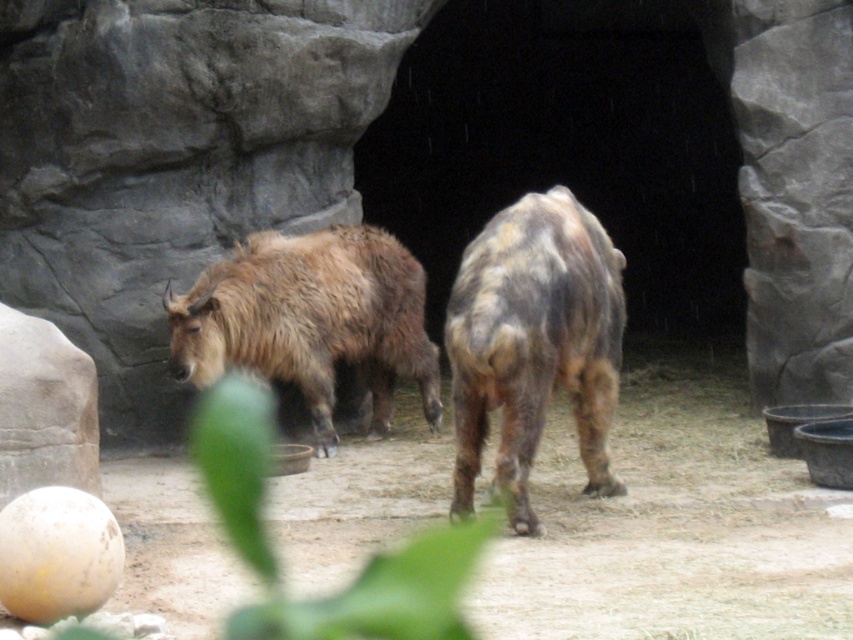
Question: From the image, what is the correct spatial relationship of brown fuzzy yak at center in relation to fuzzy brown yak at center?

Choices:
 (A) left
 (B) right

Answer: (B)

Question: Which object appears farthest from the camera in this image?

Choices:
 (A) brown fuzzy yak at center
 (B) fuzzy brown yak at center

Answer: (B)

Question: Which of the following is the farthest from the observer?

Choices:
 (A) brown fuzzy yak at center
 (B) fuzzy brown yak at center

Answer: (B)

Question: Is the position of brown fuzzy yak at center more distant than that of fuzzy brown yak at center?

Choices:
 (A) no
 (B) yes

Answer: (A)

Question: Which object is closer to the camera taking this photo?

Choices:
 (A) fuzzy brown yak at center
 (B) brown fuzzy yak at center

Answer: (B)

Question: Observing the image, what is the correct spatial positioning of brown fuzzy yak at center in reference to fuzzy brown yak at center?

Choices:
 (A) below
 (B) above

Answer: (A)